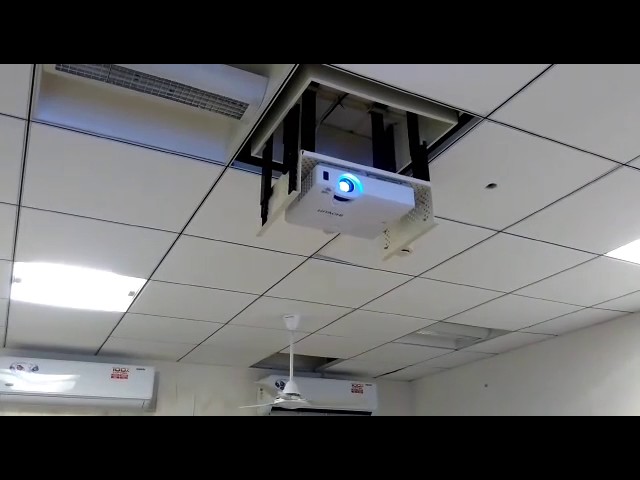
In order to click on vent in this screenshot , I will do `click(198, 100)`.